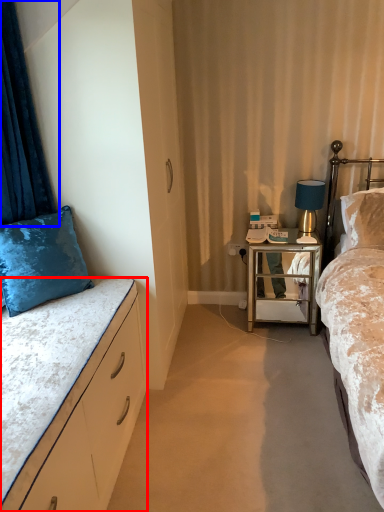
Question: Which of the following is the farthest to the observer, bed (highlighted by a red box) or curtain (highlighted by a blue box)?

Choices:
 (A) bed
 (B) curtain

Answer: (B)